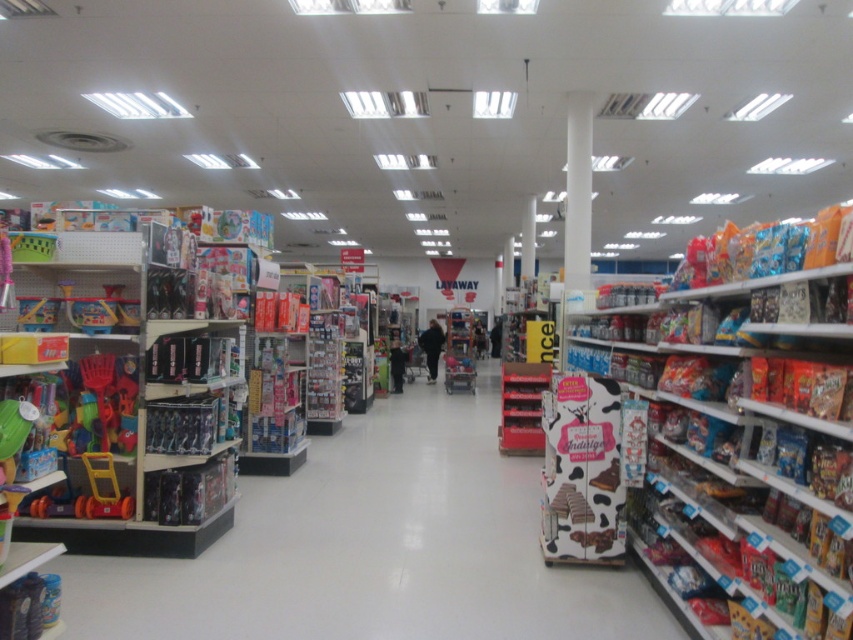
Question: Estimate the real-world distances between objects in this image. Which object is closer to the matte cardboard box at right?

Choices:
 (A) white smooth pillar at center
 (B) black fabric pants at center

Answer: (A)

Question: Which object is the closest to the plastic toys at left?

Choices:
 (A) black fabric pants at center
 (B) cow print cardboard at center
 (C) white smooth pillar at center

Answer: (B)

Question: Can you confirm if matte cardboard box at right is wider than cow print cardboard at center?

Choices:
 (A) no
 (B) yes

Answer: (B)

Question: Which of the following is the farthest from the observer?

Choices:
 (A) (451, 449)
 (B) (749, 513)
 (C) (592, 477)

Answer: (A)

Question: Can you confirm if matte cardboard box at right is positioned below black fabric pants at center?

Choices:
 (A) no
 (B) yes

Answer: (A)

Question: Can you confirm if plastic toys at left is bigger than white smooth pillar at center?

Choices:
 (A) no
 (B) yes

Answer: (B)